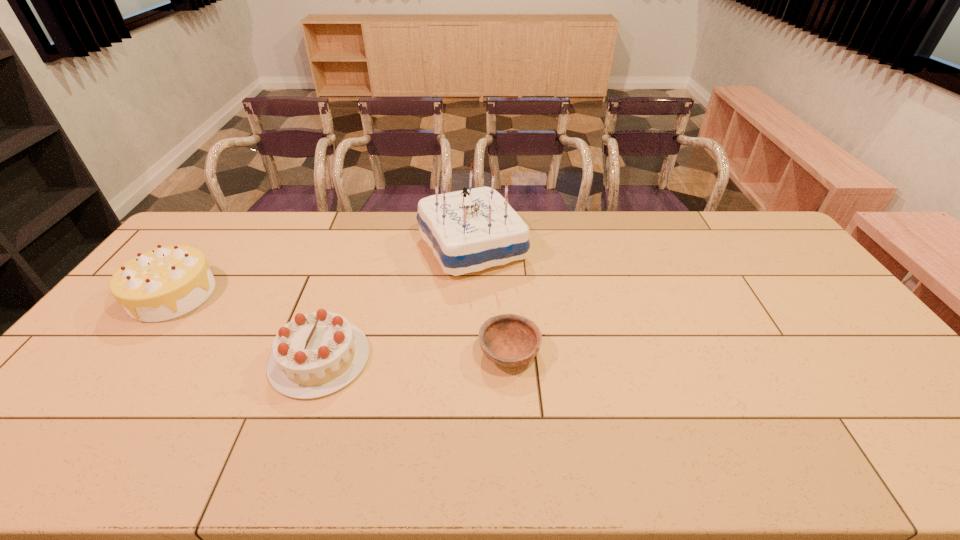
Find the location of a particular element. free space that satisfies the following two spatial constraints: 1. on the front side of the leftmost object; 2. on the left side of the second shortest object is located at coordinates (124, 359).